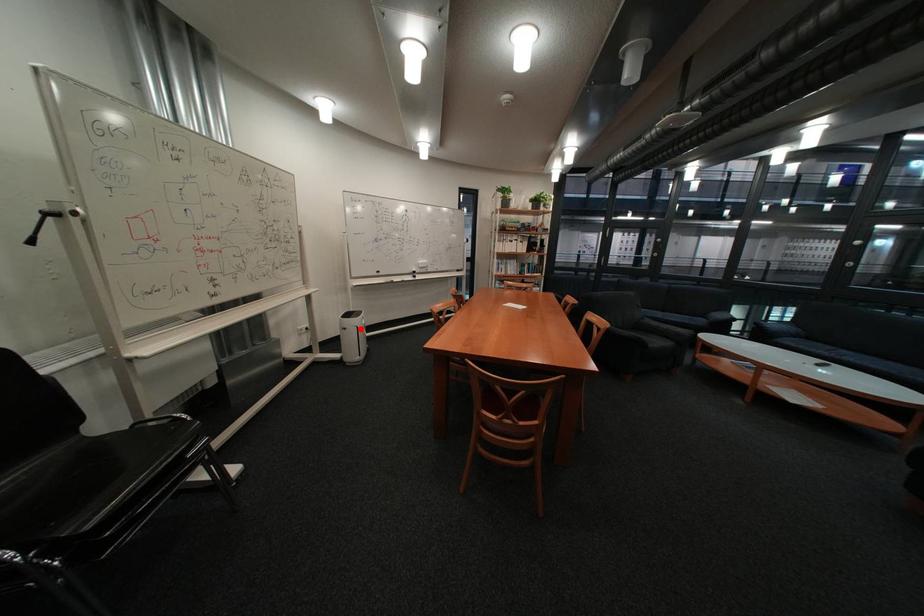
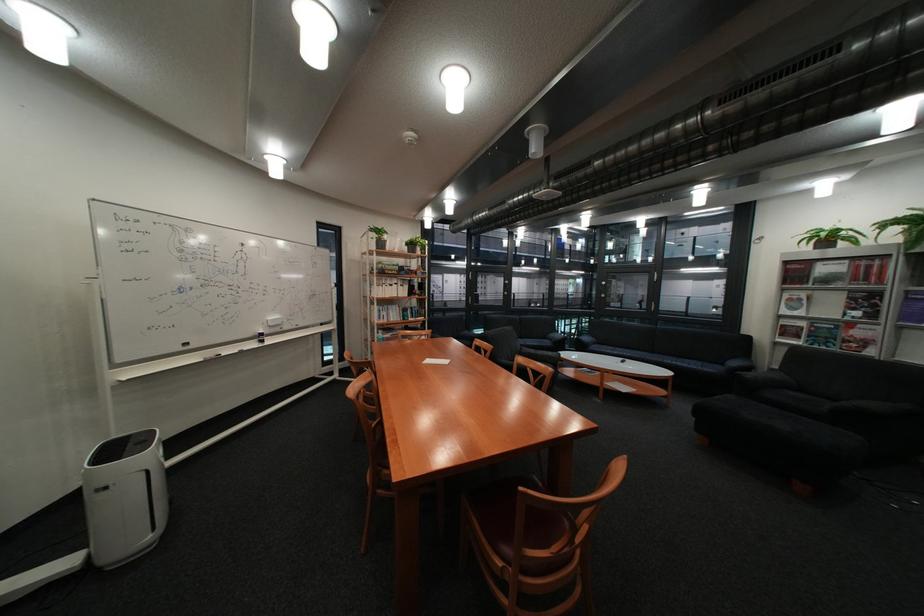
Question: I am providing you with two images of the same scene from different viewpoints. Image1 has a red point marked. In image2, the corresponding 3D location appears at what relative position? Reply with the corresponding letter.

Choices:
 (A) Closer
 (B) Farther

Answer: (A)